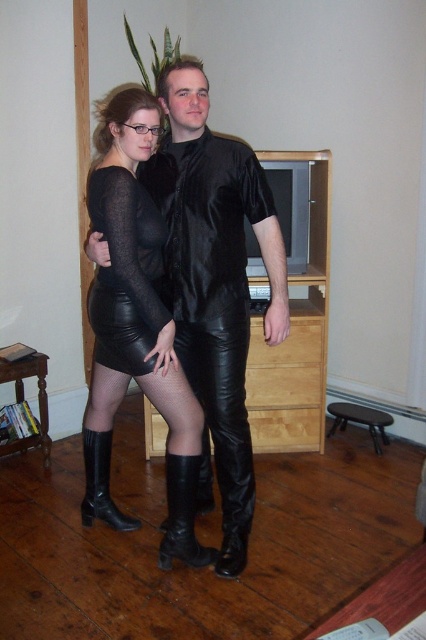
You are an interior designer assessing the living room layout. You notice the black leather pants at center and the black leather boot at lower center. Which object is closer to the right side of the room?

The black leather pants at center is positioned on the right side of the black leather boot at lower center, so it is closer to the right side of the room.

You are a photographer setting up a shoot in the living room. You need to position a light source so that it illuminates the black leather pants at center and the black leather boot at lower center without casting shadows on the light colored wooden cabinet in the background. Given their positions, which object should you place the light source closer to?

The black leather pants at center is located above the black leather boot at lower center. To avoid casting shadows on the light colored wooden cabinet, the light source should be placed closer to the black leather pants at center since it is higher and can be lit without the boot casting a shadow onto the cabinet.

Where is the black leather pants at center located in the image?

The black leather pants at center is located at point (x=222, y=420) in the image.